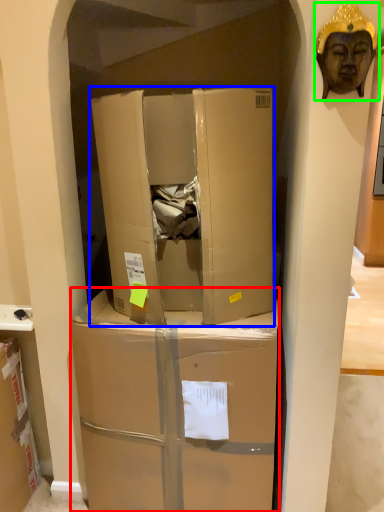
Question: Which is farther away from box (highlighted by a red box)? box (highlighted by a blue box) or person (highlighted by a green box)?

Choices:
 (A) box
 (B) person

Answer: (B)